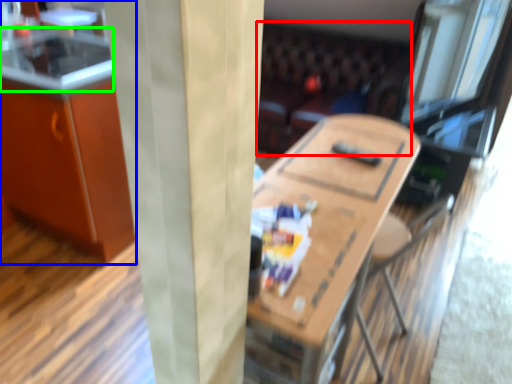
Question: Estimate the real-world distances between objects in this image. Which object is farther from couch (highlighted by a red box), cabinetry (highlighted by a blue box) or counter top (highlighted by a green box)?

Choices:
 (A) cabinetry
 (B) counter top

Answer: (B)